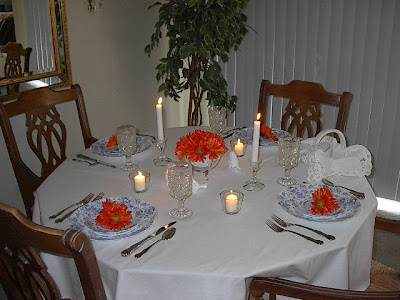
Where is `forks`? The height and width of the screenshot is (300, 400). forks is located at coordinates (99, 195), (88, 196), (275, 217), (275, 225), (154, 136).